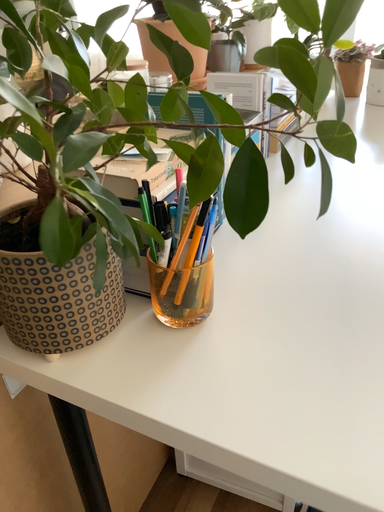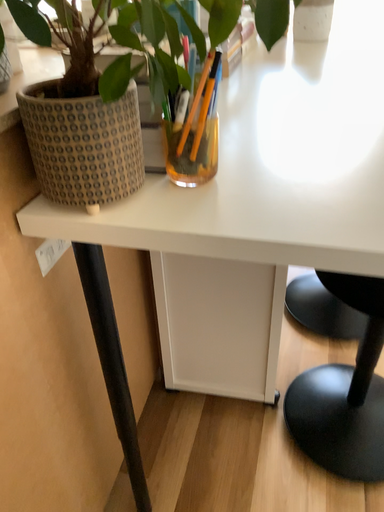
Question: Which way did the camera rotate in the video?

Choices:
 (A) rotated left
 (B) rotated right

Answer: (B)